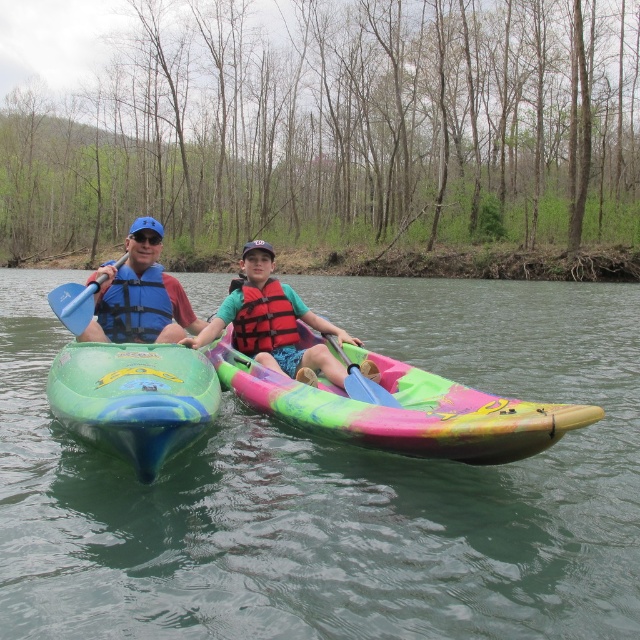
Question: Considering the real-world distances, which object is closest to the red mesh life jacket at center?

Choices:
 (A) blue fabric life vest at left
 (B) blue/textured life jacket at left
 (C) blue plastic paddle at left

Answer: (A)

Question: Which object is closer to the camera taking this photo?

Choices:
 (A) blue plastic paddle at center
 (B) red life vest at center

Answer: (A)

Question: Which point is farther from the camera taking this photo?

Choices:
 (A) (461, 461)
 (B) (68, 307)
 (C) (195, 408)

Answer: (B)

Question: Is red life vest at center smaller than blue plastic paddle at center?

Choices:
 (A) yes
 (B) no

Answer: (B)

Question: Is multicolored plastic kayak at center positioned at the back of blue plastic paddle at center?

Choices:
 (A) no
 (B) yes

Answer: (A)

Question: Can you confirm if blue plastic paddle at left is thinner than blue plastic paddle at center?

Choices:
 (A) yes
 (B) no

Answer: (A)